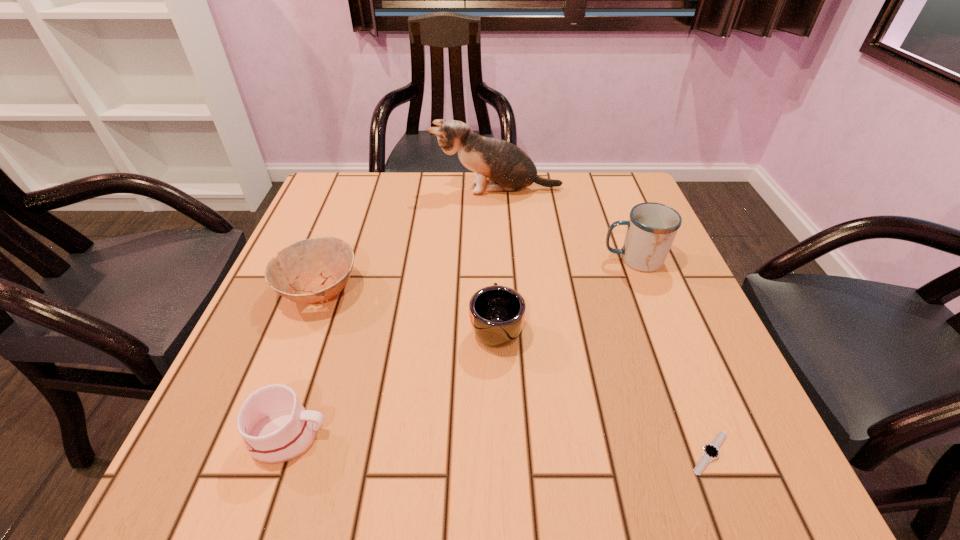
At what (x,y) coordinates should I click in order to perform the action: click on vacant area between the bowl and the rightmost mug. Please return your answer as a coordinate pair (x, y). The width and height of the screenshot is (960, 540). Looking at the image, I should click on (476, 275).

I want to click on free space that is in between the bowl and the fifth shortest object, so click(x=476, y=275).

This screenshot has height=540, width=960. I want to click on vacant point located between the tallest object and the bowl, so click(x=408, y=240).

Where is `vacant point located between the tallest mug and the bowl`? Image resolution: width=960 pixels, height=540 pixels. vacant point located between the tallest mug and the bowl is located at coordinates (476, 275).

I want to click on free point between the watch and the second nearest mug, so click(x=603, y=390).

Select which object is the third closest to the bowl. Please provide its 2D coordinates. Your answer should be formatted as a tuple, i.e. [(x, y)], where the tuple contains the x and y coordinates of a point satisfying the conditions above.

[(509, 168)]

Where is `object that can be found as the fifth closest to the tallest mug`? The width and height of the screenshot is (960, 540). object that can be found as the fifth closest to the tallest mug is located at coordinates (276, 428).

Locate which mug is the second closest to the leftmost mug. Please provide its 2D coordinates. Your answer should be formatted as a tuple, i.e. [(x, y)], where the tuple contains the x and y coordinates of a point satisfying the conditions above.

[(652, 227)]

Where is `mug that is the closest one to the bowl`? This screenshot has width=960, height=540. mug that is the closest one to the bowl is located at coordinates (276, 428).

At what (x,y) coordinates should I click in order to perform the action: click on vacant region that satisfies the following two spatial constraints: 1. at the face of the watch; 2. on the left side of the tallest object. Please return your answer as a coordinate pair (x, y). The height and width of the screenshot is (540, 960). Looking at the image, I should click on (512, 453).